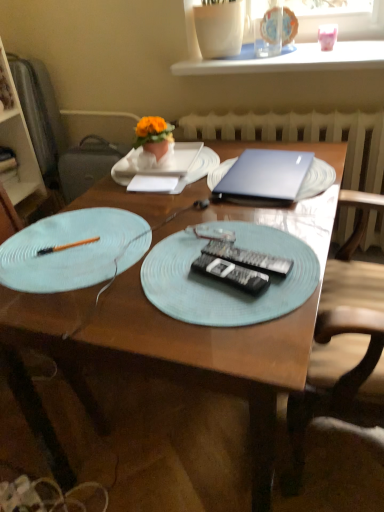
Question: Is orange fabric flower at upper center facing towards pink glossy piggy bank at upper right, acting as the first tableware starting from the right?

Choices:
 (A) yes
 (B) no

Answer: (B)

Question: From a real-world perspective, is orange fabric flower at upper center positioned under pink glossy piggy bank at upper right, acting as the second tableware starting from the left, based on gravity?

Choices:
 (A) no
 (B) yes

Answer: (B)

Question: Is orange fabric flower at upper center far from pink glossy piggy bank at upper right, acting as the second tableware starting from the left?

Choices:
 (A) no
 (B) yes

Answer: (A)

Question: Is orange fabric flower at upper center shorter than pink glossy piggy bank at upper right, acting as the second tableware starting from the left?

Choices:
 (A) no
 (B) yes

Answer: (A)

Question: Is orange fabric flower at upper center turned away from pink glossy piggy bank at upper right, acting as the first tableware starting from the right?

Choices:
 (A) no
 (B) yes

Answer: (A)

Question: Considering the relative sizes of orange fabric flower at upper center and pink glossy piggy bank at upper right, acting as the first tableware starting from the right, in the image provided, is orange fabric flower at upper center bigger than pink glossy piggy bank at upper right, acting as the first tableware starting from the right,?

Choices:
 (A) yes
 (B) no

Answer: (A)

Question: Is light blue textured plate at left, placed as the second plate when sorted from front to back, inside black plastic remote control at center, acting as the first remote control starting from the top?

Choices:
 (A) no
 (B) yes

Answer: (A)

Question: Is black plastic remote control at center, acting as the first remote control starting from the top, outside light blue textured plate at left, placed as the second plate when sorted from front to back?

Choices:
 (A) no
 (B) yes

Answer: (B)

Question: Can you confirm if black plastic remote control at center, placed as the 2th remote control when sorted from bottom to top, is shorter than light blue textured plate at left, placed as the second plate when sorted from front to back?

Choices:
 (A) no
 (B) yes

Answer: (A)

Question: From the image's perspective, is black plastic remote control at center, acting as the first remote control starting from the top, located above light blue textured plate at left, which is counted as the 2th plate, starting from the back?

Choices:
 (A) no
 (B) yes

Answer: (A)

Question: Is black plastic remote control at center, acting as the first remote control starting from the top, positioned far away from light blue textured plate at left, placed as the second plate when sorted from front to back?

Choices:
 (A) yes
 (B) no

Answer: (B)

Question: Can you confirm if black plastic remote control at center, placed as the 2th remote control when sorted from bottom to top, is taller than light blue textured plate at left, placed as the second plate when sorted from front to back?

Choices:
 (A) no
 (B) yes

Answer: (B)

Question: Considering the relative sizes of orange fabric flower at upper center and white textured radiator at center in the image provided, is orange fabric flower at upper center shorter than white textured radiator at center?

Choices:
 (A) no
 (B) yes

Answer: (B)